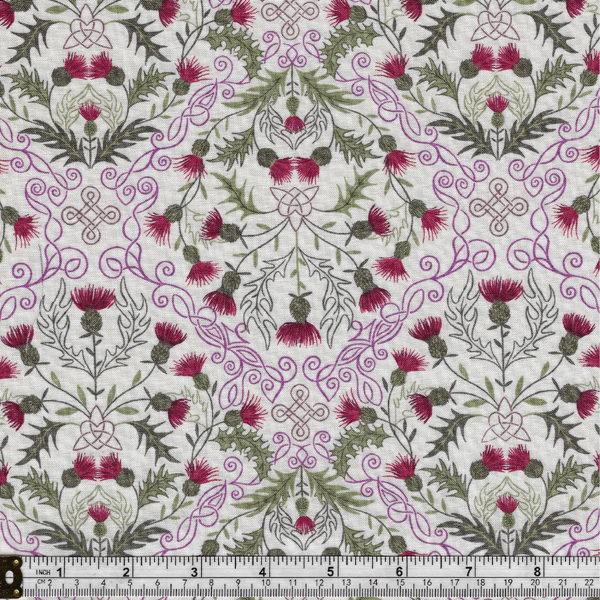
At what (x,y) coordinates should I click in order to perform the action: click on hook. Please return your answer as a coordinate pair (x, y). This screenshot has height=600, width=600. Looking at the image, I should click on (17, 579).